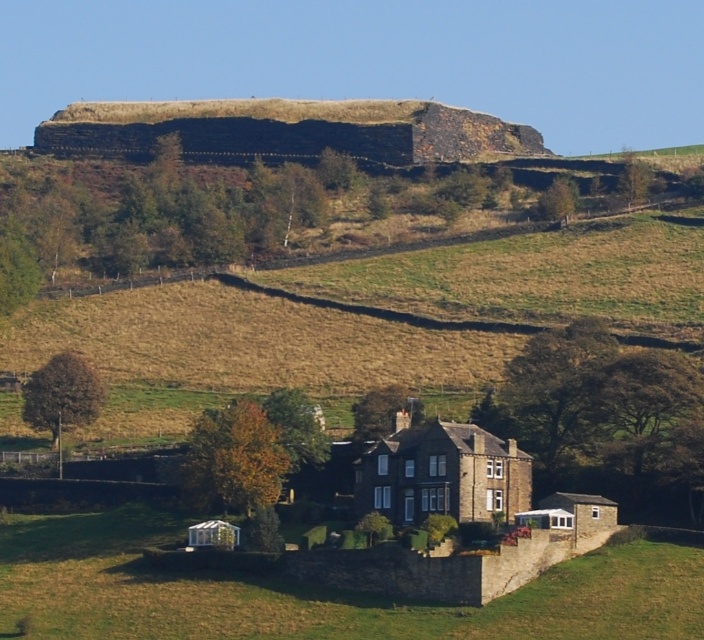
You are standing at the base of the hill where the brown stone house at center is located. You want to walk towards the large stone structure in the background. Which direction should you walk relative to the green grass at lower center?

You should walk to the right of the green grass at lower center because the brown stone house at center is to the right of the green grass, and the large stone structure in the background is behind the house.

You are standing at the base of the hillfort and want to reach the house. There are two points marked on the path. Which point should you pass first, point (169, 636) or point (491, 490)?

You should pass point (169, 636) first because it is in front of point (491, 490) along the path towards the house.